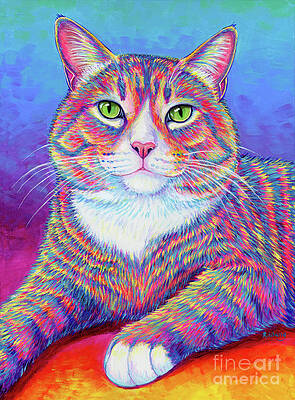
Identify the location of white fur. (124, 369), (138, 225), (144, 182), (144, 124), (123, 161), (153, 159), (115, 124), (171, 126), (125, 103), (164, 110).